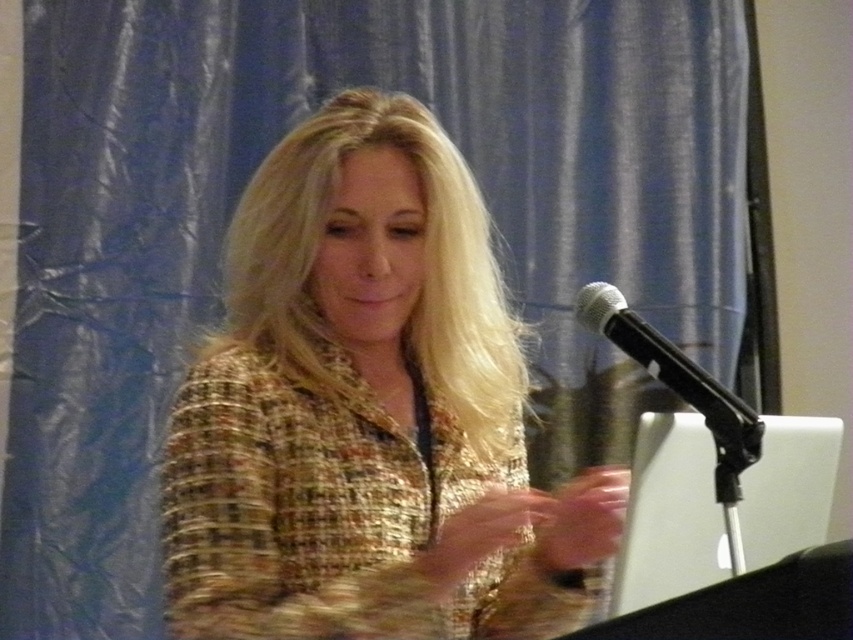
Who is higher up, multicolored tweed jacket at center or black metallic microphone at upper right?

multicolored tweed jacket at center is higher up.

Who is taller, multicolored tweed jacket at center or black metallic microphone at upper right?

multicolored tweed jacket at center

Identify the location of multicolored tweed jacket at center. (367, 412).

Which is in front, point (741, 506) or point (717, 436)?

Point (717, 436)

Which is behind, point (648, 512) or point (718, 449)?

The point (648, 512) is more distant.

Find the location of `white plastic laptop at lower right`. white plastic laptop at lower right is located at coordinates (669, 515).

Which is in front, point (440, 328) or point (642, 435)?

Positioned in front is point (440, 328).

Consider the image. Which is above, multicolored tweed jacket at center or white plastic laptop at lower right?

multicolored tweed jacket at center is higher up.

What do you see at coordinates (367, 412) in the screenshot? This screenshot has height=640, width=853. I see `multicolored tweed jacket at center` at bounding box center [367, 412].

Locate an element on the screen. multicolored tweed jacket at center is located at coordinates (367, 412).